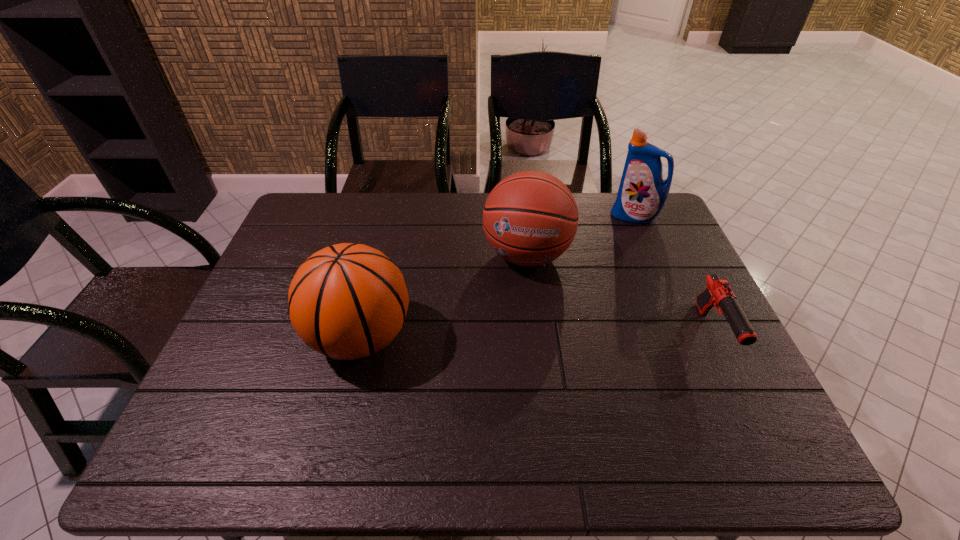
At what (x,y) coordinates should I click in order to perform the action: click on vacant region between the third object from right to left and the gun. Please return your answer as a coordinate pair (x, y). Image resolution: width=960 pixels, height=540 pixels. Looking at the image, I should click on (620, 294).

Where is `free space between the gun and the detergent`? This screenshot has height=540, width=960. free space between the gun and the detergent is located at coordinates (674, 275).

This screenshot has height=540, width=960. I want to click on free space between the shortest object and the second object from left to right, so click(620, 294).

This screenshot has width=960, height=540. Identify the location of blank region between the nearer basketball and the detergent. (497, 277).

The height and width of the screenshot is (540, 960). In order to click on free space between the shortest object and the third nearest object in this screenshot , I will do `click(620, 294)`.

This screenshot has width=960, height=540. Find the location of `empty space that is in between the detergent and the right basketball`. empty space that is in between the detergent and the right basketball is located at coordinates (581, 235).

The width and height of the screenshot is (960, 540). In order to click on object that is the closest one to the gun in this screenshot , I will do `click(530, 218)`.

Locate an element on the screen. The image size is (960, 540). object that can be found as the closest to the farther basketball is located at coordinates coord(642,194).